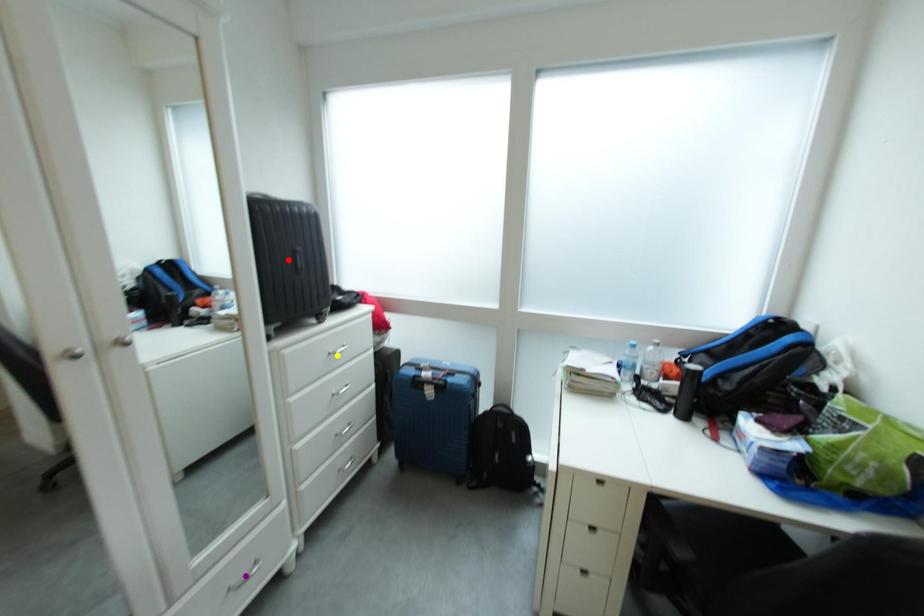
Order these from nearest to farthest:
red point, purple point, yellow point

purple point
red point
yellow point